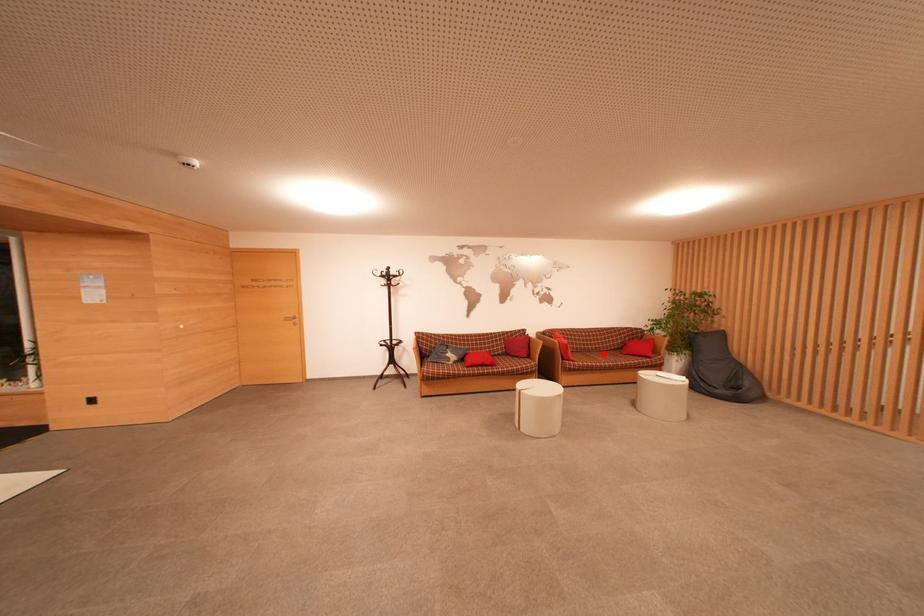
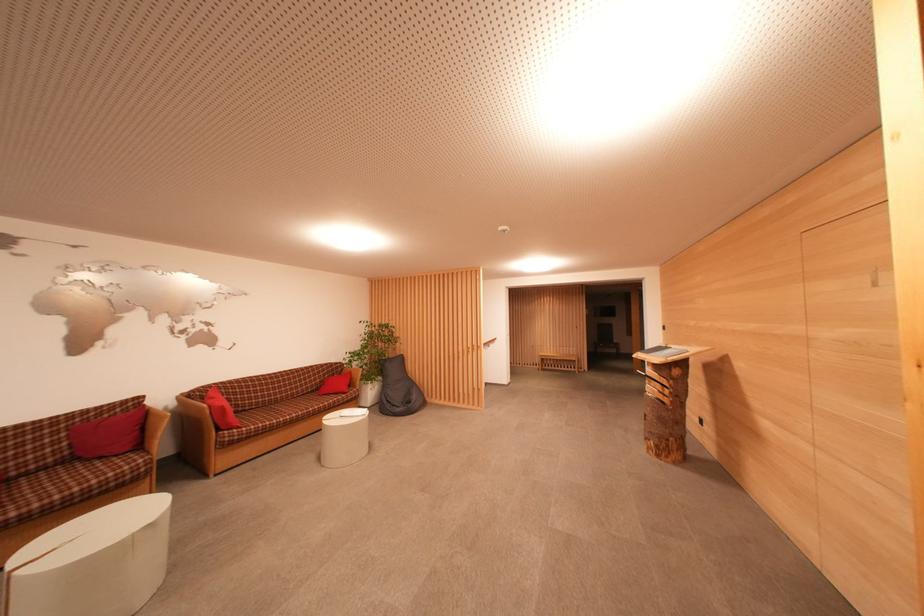
Question: I am providing you with two images of the same scene from different viewpoints. Given a red point in image1, look at the same physical point in image2. Is it:

Choices:
 (A) Closer to the viewpoint
 (B) Farther from the viewpoint

Answer: (A)